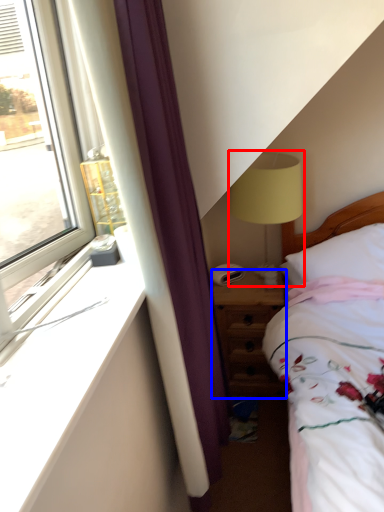
Question: Which point is further to the camera, table lamp (highlighted by a red box) or nightstand (highlighted by a blue box)?

Choices:
 (A) table lamp
 (B) nightstand

Answer: (B)